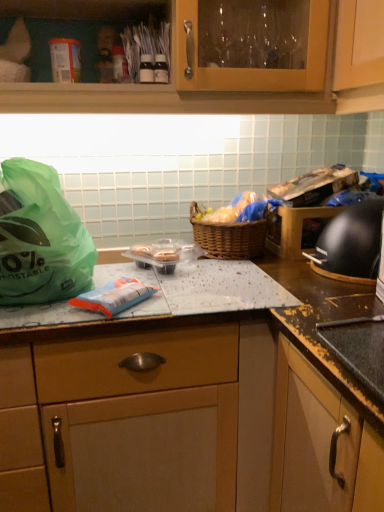
Locate an element on the screen. The height and width of the screenshot is (512, 384). vacant area to the right of green plastic bag at left is located at coordinates (167, 293).